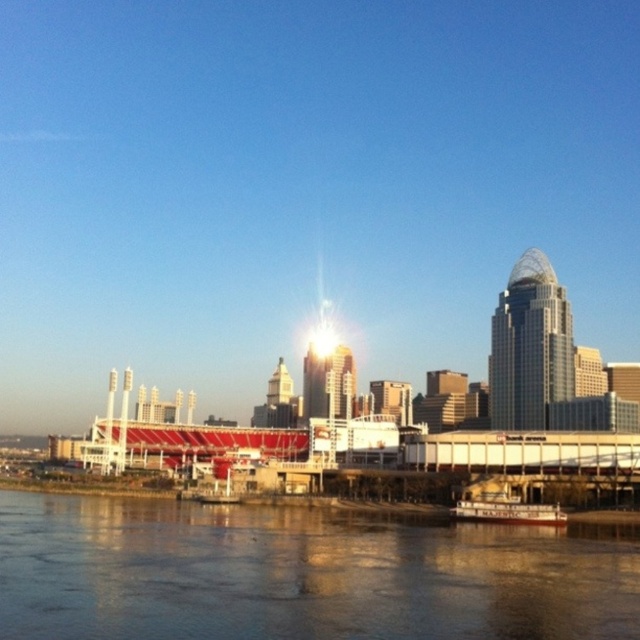
You are a photographer planning to capture the reflection of the white wooden boat at lower center in the brown smooth water at lower center. Considering the width of both objects, will the entire boat fit within the water surface to be fully reflected?

The brown smooth water at lower center is wider than the white wooden boat at lower center, so the entire boat can fit within the water surface to be fully reflected.

Looking at this image, you are standing at the point with coordinates point (557, 508) and want to move to the point labeled point (401, 625). Which direction should you move relative to the other point?

Point (401, 625) is in front of point (557, 508), so you should move forward towards it.